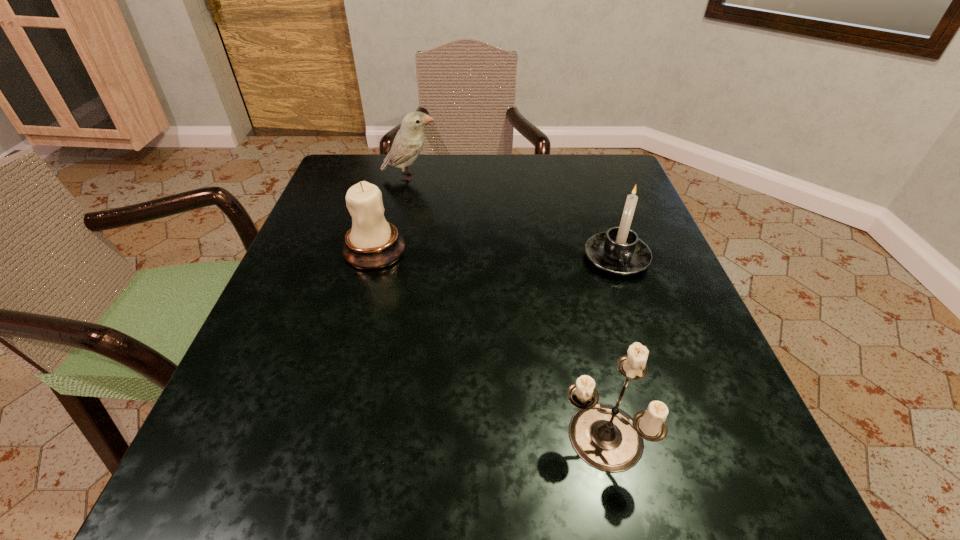
This screenshot has width=960, height=540. I want to click on object present at the far left corner, so click(x=409, y=140).

Locate an element on the screen. The image size is (960, 540). object situated at the near right corner is located at coordinates (605, 437).

Where is `vacant region at the far edge`? This screenshot has width=960, height=540. vacant region at the far edge is located at coordinates (540, 172).

Where is `free region at the near edge of the desktop`? The width and height of the screenshot is (960, 540). free region at the near edge of the desktop is located at coordinates (514, 506).

The width and height of the screenshot is (960, 540). In the image, there is a desktop. Find the location of `vacant space at the left edge`. vacant space at the left edge is located at coordinates point(319,241).

Where is `free space at the right edge of the desktop`? The width and height of the screenshot is (960, 540). free space at the right edge of the desktop is located at coordinates point(595,231).

The width and height of the screenshot is (960, 540). In the image, there is a desktop. In order to click on free region at the near left corner in this screenshot , I will do `click(244, 517)`.

Identify the location of vacant region at the far right corner. pyautogui.click(x=612, y=175).

Identify the location of vacant space at the near right corner of the desktop. The height and width of the screenshot is (540, 960). (660, 461).

Locate an element on the screen. Image resolution: width=960 pixels, height=540 pixels. unoccupied position between the leftmost candle holder and the nearest candle holder is located at coordinates (488, 343).